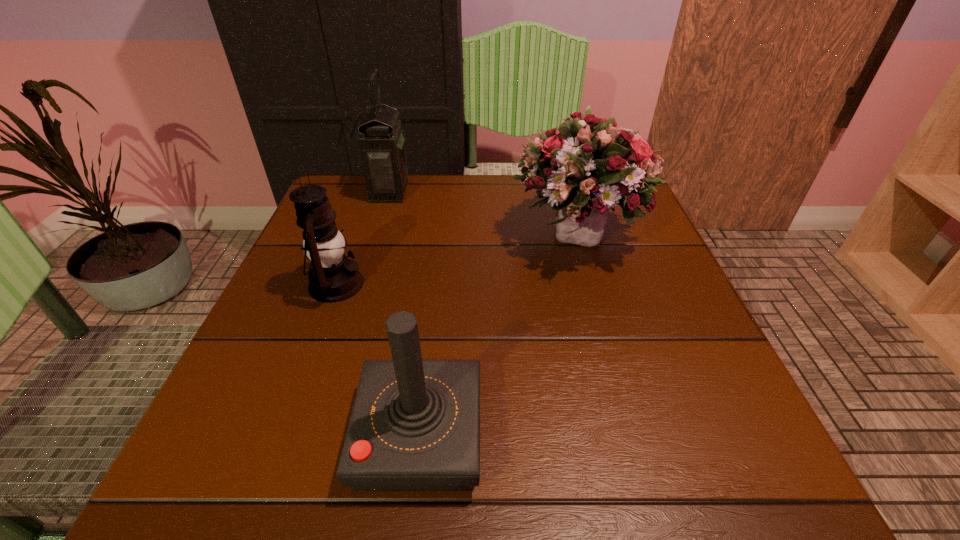
This screenshot has width=960, height=540. In order to click on bouquet situated at the far edge in this screenshot , I will do `click(589, 167)`.

At what (x,y) coordinates should I click in order to perform the action: click on object located in the near edge section of the desktop. Please return your answer as a coordinate pair (x, y). This screenshot has width=960, height=540. Looking at the image, I should click on (415, 424).

You are a GUI agent. You are given a task and a screenshot of the screen. Output one action in this format:
    pyautogui.click(x=<x>, y=<y>)
    Task: Click on the object that is at the right edge
    
    Given the screenshot: What is the action you would take?
    pyautogui.click(x=589, y=167)

Where is `object located in the far left corner section of the desktop`? object located in the far left corner section of the desktop is located at coordinates (382, 146).

The image size is (960, 540). What are the coordinates of `object that is at the far right corner` in the screenshot? It's located at (589, 167).

What are the coordinates of `free space at the far edge` in the screenshot? It's located at (475, 215).

Image resolution: width=960 pixels, height=540 pixels. In the image, there is a desktop. In order to click on vacant space at the near edge in this screenshot , I will do `click(511, 491)`.

Locate an element on the screen. vacant space at the left edge of the desktop is located at coordinates click(x=344, y=332).

In order to click on free space at the right edge of the desktop in this screenshot , I will do `click(663, 249)`.

Identify the location of free space at the near left corner of the desktop. Image resolution: width=960 pixels, height=540 pixels. (252, 456).